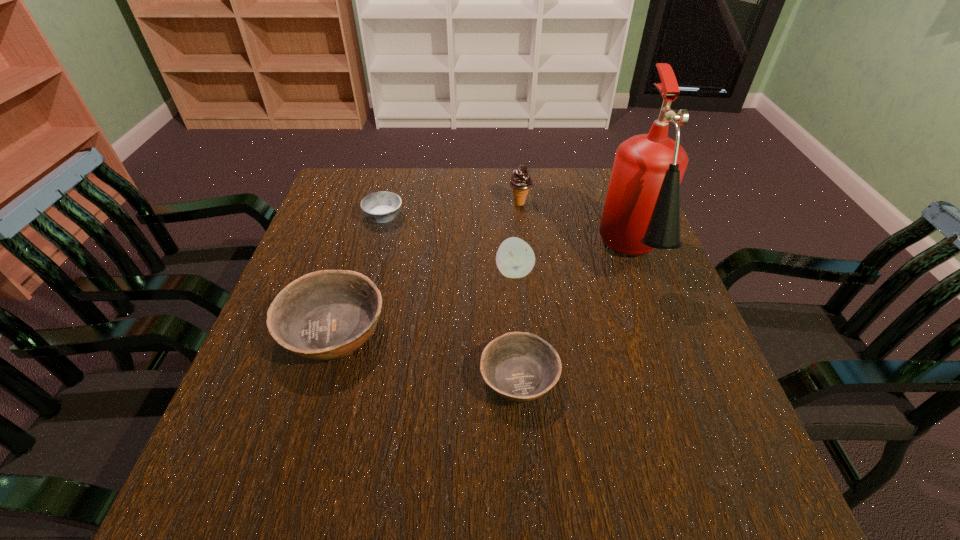
Identify the location of the taller bowl. Image resolution: width=960 pixels, height=540 pixels. (327, 314).

Identify the location of the third shortest object. (327, 314).

Locate an element on the screen. The width and height of the screenshot is (960, 540). the right bowl is located at coordinates (519, 366).

Find the location of a particular element. icecream is located at coordinates (520, 181).

Where is `ashtray`? ashtray is located at coordinates (381, 207).

At what (x,y) coordinates should I click in order to perform the action: click on the tallest object. Please return your answer as a coordinate pair (x, y). Looking at the image, I should click on (641, 212).

Find the location of a particular element. fire extinguisher is located at coordinates (641, 212).

The width and height of the screenshot is (960, 540). What are the coordinates of `apple` in the screenshot? It's located at (515, 258).

Find the location of a particular element. The image size is (960, 540). vacant position located 0.200m on the right of the left bowl is located at coordinates (482, 332).

Locate an element on the screen. The image size is (960, 540). free space located on the front of the right bowl is located at coordinates (524, 441).